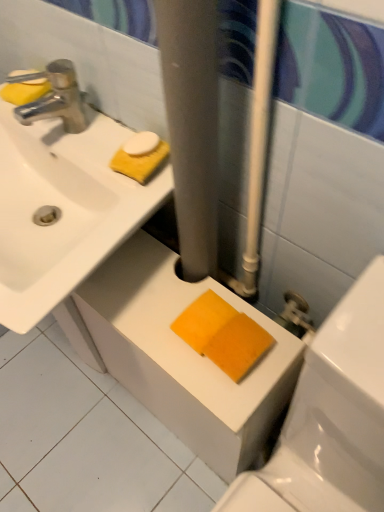
This screenshot has height=512, width=384. I want to click on free spot above orange sponge at lower center (from a real-world perspective), so click(153, 286).